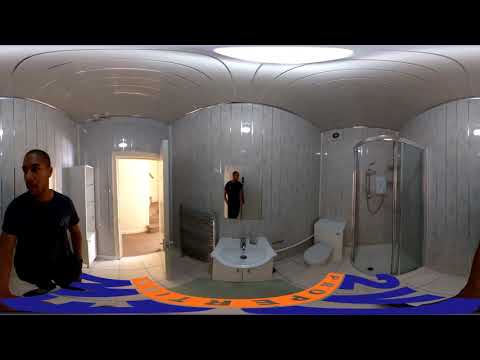
At what (x,y) coordinates should I click in order to perform the action: click on bathroom. Please return your answer as a coordinate pair (x, y). Image resolution: width=480 pixels, height=360 pixels. Looking at the image, I should click on (276, 277).